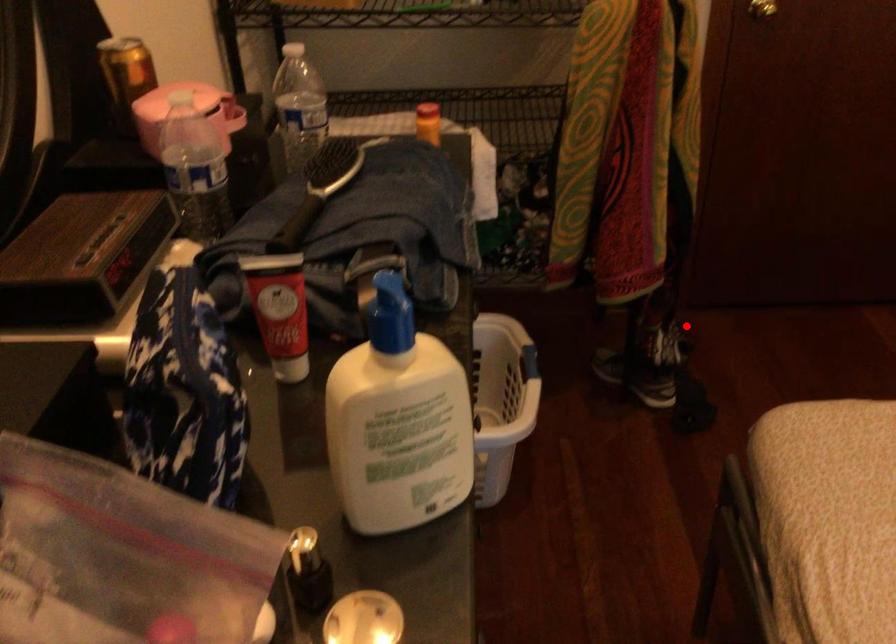
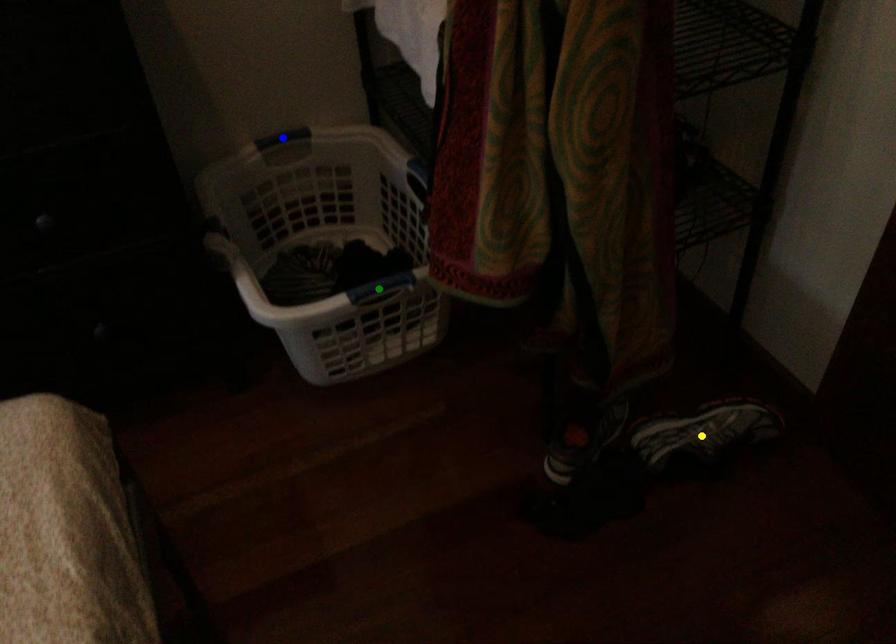
Question: I am providing you with two images of the same scene from different viewpoints. A red point is marked on the first image. You are given multiple points on the second image. Which point in image 2 is actually the same real-world point as the red point in image 1?

Choices:
 (A) green point
 (B) blue point
 (C) yellow point

Answer: (C)